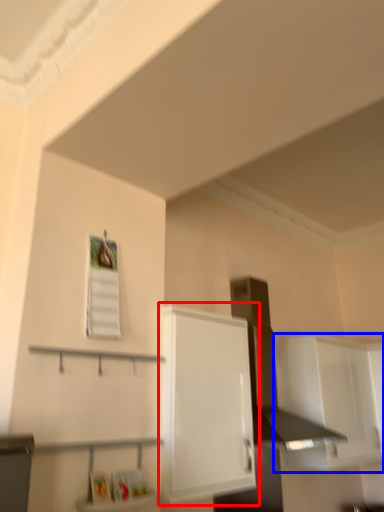
Question: Which of the following is the closest to the observer, cabinetry (highlighted by a red box) or cabinetry (highlighted by a blue box)?

Choices:
 (A) cabinetry
 (B) cabinetry

Answer: (A)